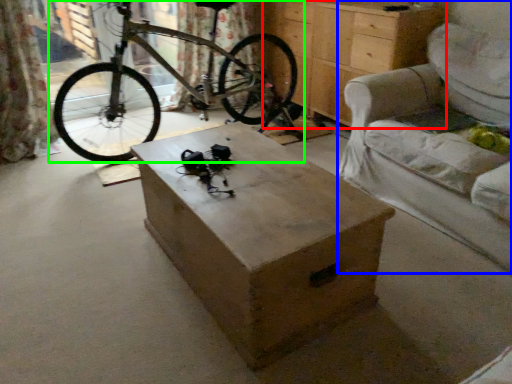
Question: Estimate the real-world distances between objects in this image. Which object is closer to chest of drawers (highlighted by a red box), armchair (highlighted by a blue box) or bicycle (highlighted by a green box)?

Choices:
 (A) armchair
 (B) bicycle

Answer: (A)